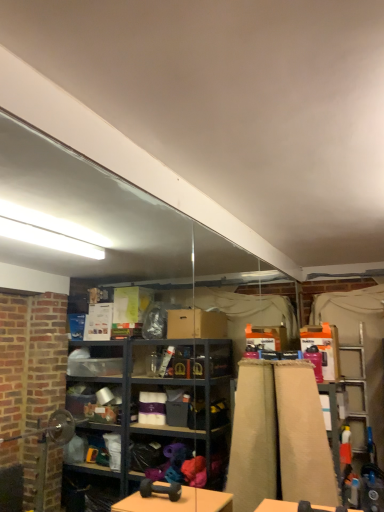
This screenshot has width=384, height=512. I want to click on beige fabric curtain at right, so click(x=303, y=437).

Image resolution: width=384 pixels, height=512 pixels. What do you see at coordinates (303, 437) in the screenshot?
I see `beige fabric curtain at right` at bounding box center [303, 437].

This screenshot has width=384, height=512. I want to click on beige fabric curtain at right, so click(303, 437).